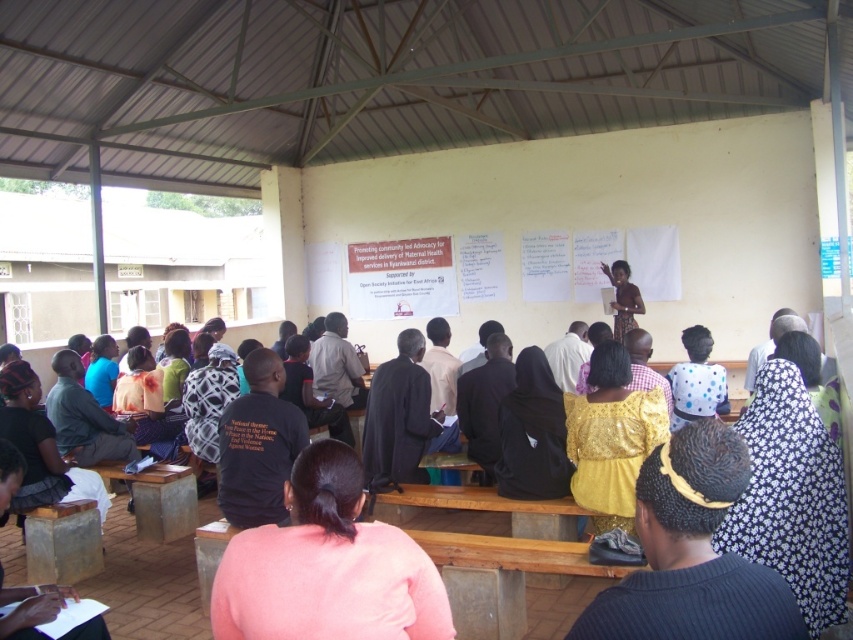
You are organizing a fashion show and need to arrange the floral fabric dress at lower right and the yellow fabric dress at center based on their sizes. Which dress should be placed first if you want to arrange them from smallest to largest?

The floral fabric dress at lower right should be placed first because it has a smaller size compared to the yellow fabric dress at center.

You are standing at the entrance of the venue and see the point marked at (791, 497). What object is located at that point?

The point at (791, 497) corresponds to the floral fabric dress at lower right.

You are a photographer taking a portrait of the black matte hijab at center and the yellow fabric dress at center. Which object should you focus on if you want to capture the wider one in the image?

The black matte hijab at center might be wider than yellow fabric dress at center, so you should focus on the black matte hijab at center to capture the wider one.